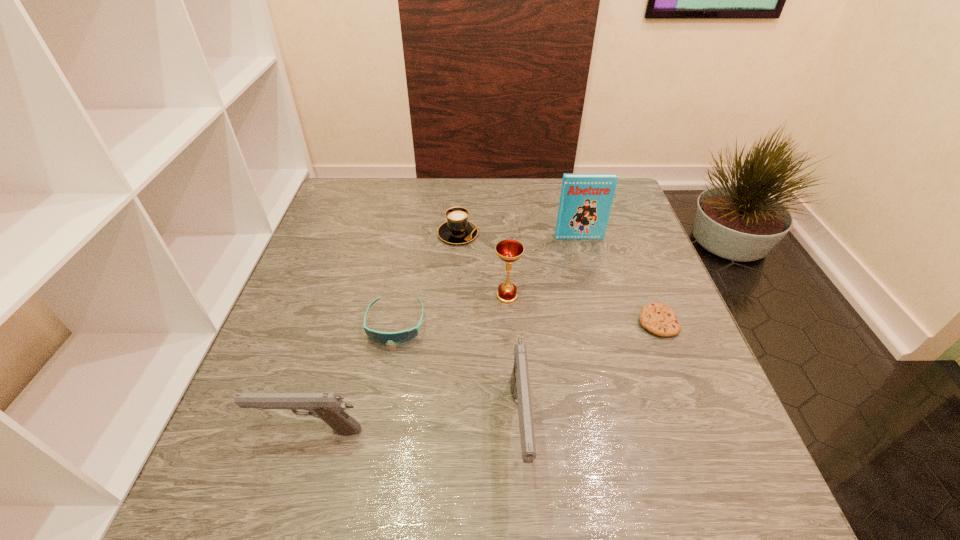
Please point a spot on the right to add another pistol. Please provide its 2D coordinates. Your answer should be formatted as a tuple, i.e. [(x, y)], where the tuple contains the x and y coordinates of a point satisfying the conditions above.

[(727, 426)]